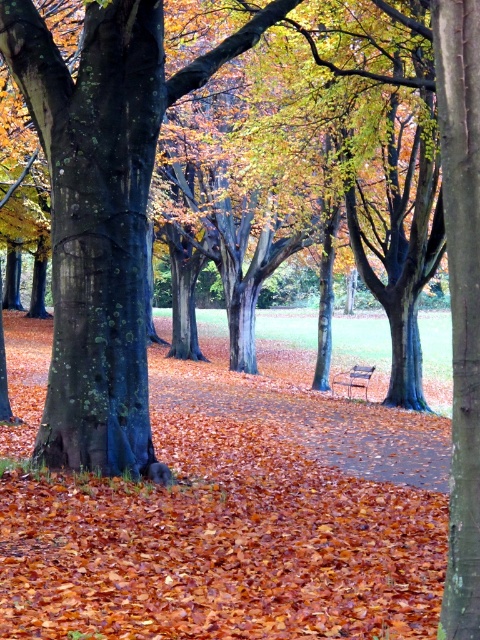
Question: Does smooth bark tree at center lie behind wooden park bench at center?

Choices:
 (A) yes
 (B) no

Answer: (B)

Question: Is smooth bark tree at center closer to camera compared to wooden park bench at center?

Choices:
 (A) yes
 (B) no

Answer: (A)

Question: Which point is closer to the camera?

Choices:
 (A) wooden park bench at center
 (B) smooth bark tree at center

Answer: (B)

Question: Which object is closer to the camera taking this photo?

Choices:
 (A) smooth bark tree at center
 (B) wooden park bench at center

Answer: (A)

Question: Is smooth bark tree at center below wooden park bench at center?

Choices:
 (A) yes
 (B) no

Answer: (B)